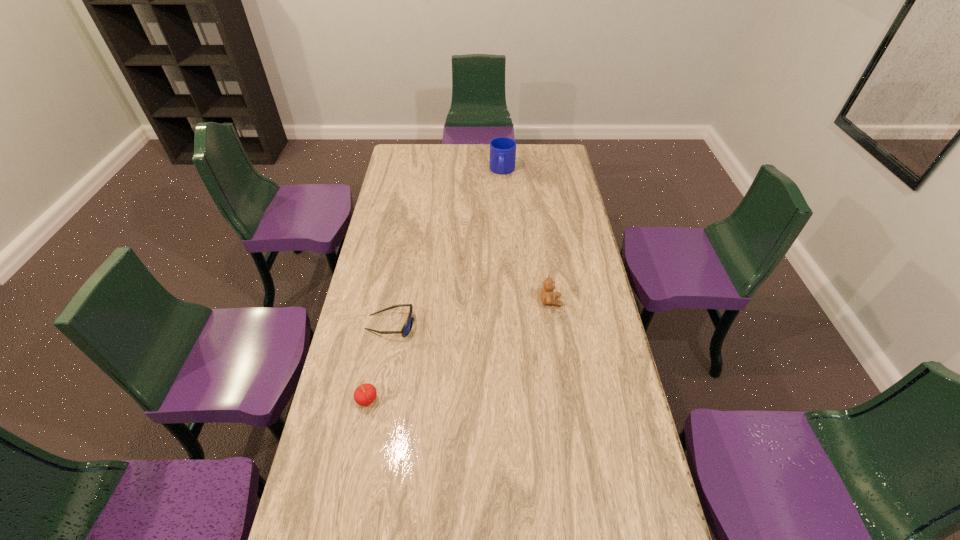
Find the location of a particular element. free space that is in between the shortest object and the teddy bear is located at coordinates (470, 313).

Where is `free point between the rightmost object and the mug`? free point between the rightmost object and the mug is located at coordinates (527, 236).

Identify which object is the second closest to the rightmost object. Please provide its 2D coordinates. Your answer should be formatted as a tuple, i.e. [(x, y)], where the tuple contains the x and y coordinates of a point satisfying the conditions above.

[(365, 394)]

At what (x,y) coordinates should I click in order to perform the action: click on object that is the second nearest to the cherry. Please return your answer as a coordinate pair (x, y). Looking at the image, I should click on (548, 296).

The image size is (960, 540). Find the location of `free location that satisfies the following two spatial constraints: 1. on the back side of the farthest object; 2. on the right side of the shortest object`. free location that satisfies the following two spatial constraints: 1. on the back side of the farthest object; 2. on the right side of the shortest object is located at coordinates (418, 171).

Locate an element on the screen. This screenshot has width=960, height=540. blank space that satisfies the following two spatial constraints: 1. on the front side of the second object from right to left; 2. on the front-facing side of the rightmost object is located at coordinates (511, 301).

The width and height of the screenshot is (960, 540). I want to click on vacant space that satisfies the following two spatial constraints: 1. on the back side of the cherry; 2. on the left side of the shortest object, so click(x=381, y=325).

Find the location of a particular element. vacant area in the image that satisfies the following two spatial constraints: 1. on the back side of the teddy bear; 2. on the front-facing side of the cherry is located at coordinates (386, 301).

I want to click on vacant space that satisfies the following two spatial constraints: 1. on the back side of the teddy bear; 2. on the front-facing side of the sunglasses, so click(x=395, y=301).